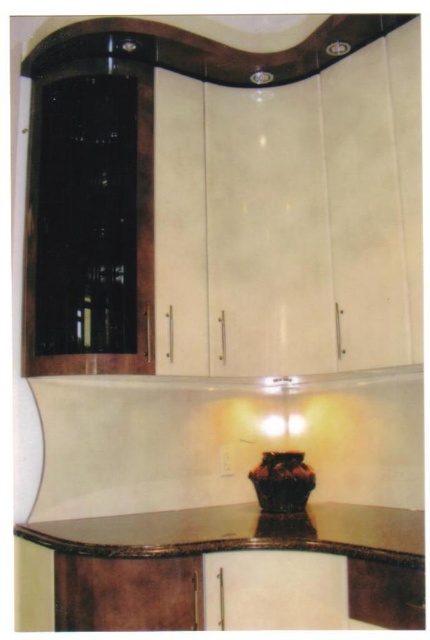
From the picture: You are standing in the kitchen and want to reach the point marked at coordinates (x=369, y=506). If you can stretch your arm 1.8 meters, can you reach that point without moving?

The point marked at coordinates (x=369, y=506) is 2.30 meters away from you. Since your arm can only stretch 1.8 meters, you cannot reach that point without moving closer.

You are a delivery person trying to place a large package on the brown marble countertop at center. However, there is already a brown glossy vase at center on it. Can you fit the package next to the vase without moving it?

The brown marble countertop at center might be wider than brown glossy vase at center, so there could be enough space to place the package next to the vase without moving it.

You are arranging flowers in a modern kitchen and see the brown glossy vase at center and the brown marble countertop at center. Where should you place the vase to ensure it is positioned correctly according to the scene?

The brown glossy vase at center should be placed above the brown marble countertop at center since the brown marble countertop at center is below the brown glossy vase at center.